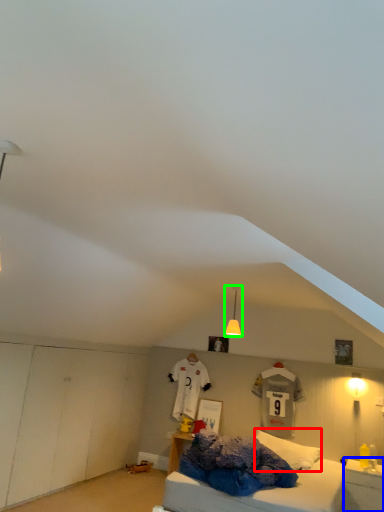
Question: Estimate the real-world distances between objects in this image. Which object is farther from pillow (highlighted by a red box), nightstand (highlighted by a blue box) or light fixture (highlighted by a green box)?

Choices:
 (A) nightstand
 (B) light fixture

Answer: (B)